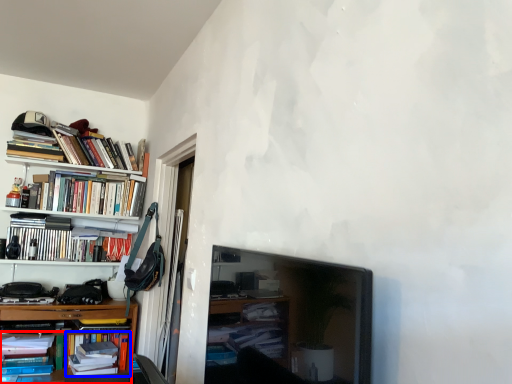
Question: Which of the following is the farthest to the observer, book (highlighted by a red box) or book (highlighted by a blue box)?

Choices:
 (A) book
 (B) book

Answer: (B)